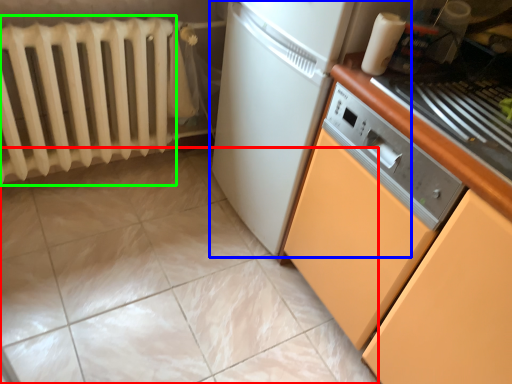
Question: Estimate the real-world distances between objects in this image. Which object is closer to ceramic tile (highlighted by a red box), home appliance (highlighted by a blue box) or radiator (highlighted by a green box)?

Choices:
 (A) home appliance
 (B) radiator

Answer: (B)